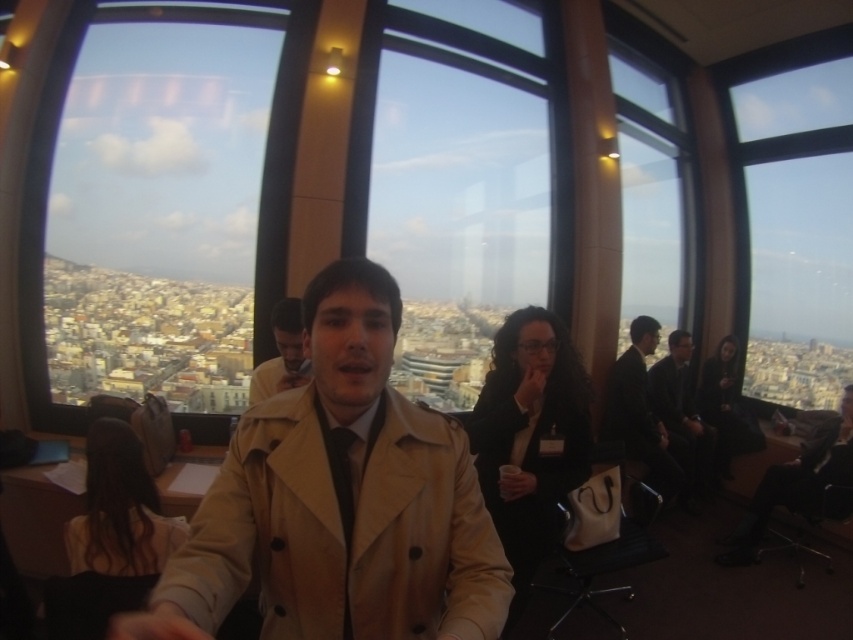
You are standing in the room and want to take a photo of the urban landscape outside. The transparent glass window at upper left is represented by point (144, 211). Where should you position yourself to ensure the transparent glass window at upper left is in the frame of your camera?

Position yourself near the center of the room facing the transparent glass window at upper left to ensure it is within the camera frame.